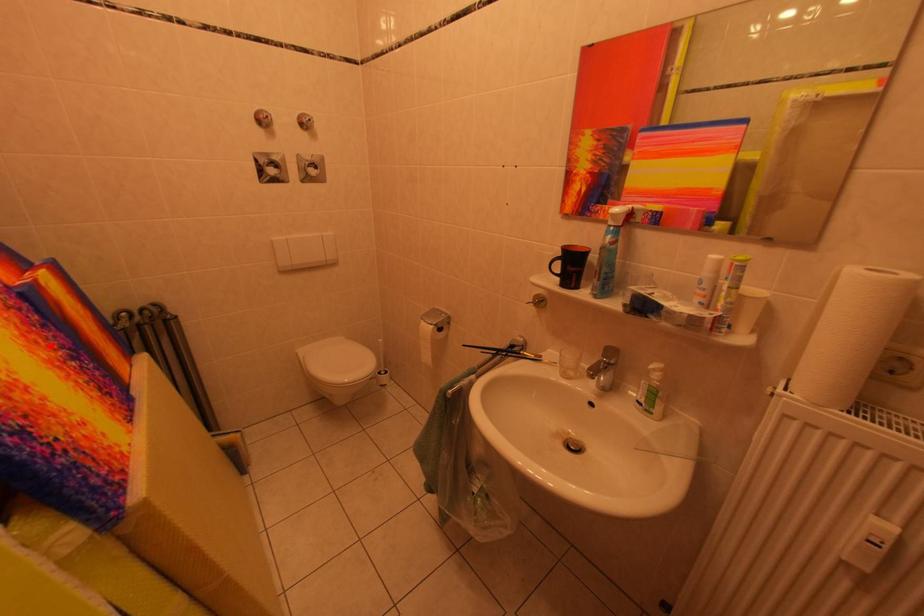
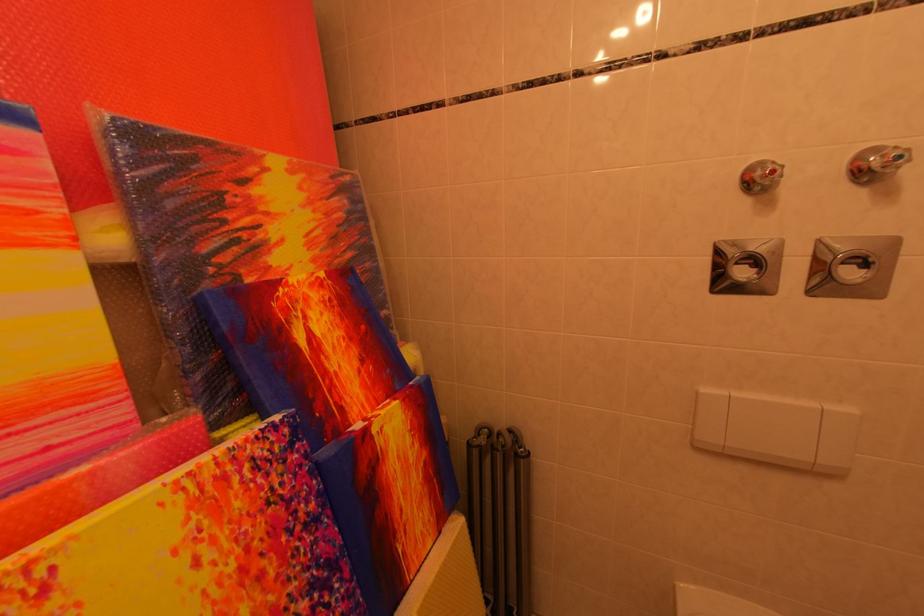
The point at the highlighted location is marked in the first image. Where is the corresponding point in the second image?

(281, 575)